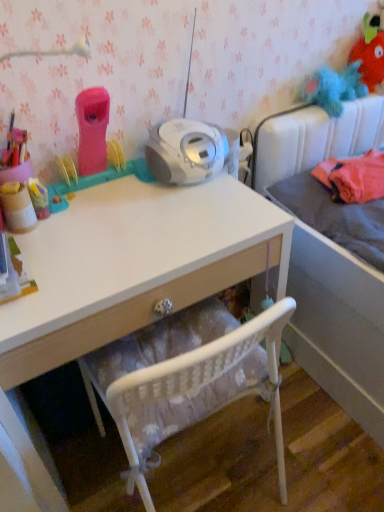
Question: From a real-world perspective, is fluffy plush toy at upper right, which appears as the first toy when viewed from the top, on top of gray fabric mattress at right?

Choices:
 (A) no
 (B) yes

Answer: (B)

Question: Can you confirm if fluffy plush toy at upper right, positioned as the 3th toy in bottom-to-top order, is wider than gray fabric mattress at right?

Choices:
 (A) yes
 (B) no

Answer: (B)

Question: From the image's perspective, would you say fluffy plush toy at upper right, positioned as the 3th toy in bottom-to-top order, is shown under gray fabric mattress at right?

Choices:
 (A) yes
 (B) no

Answer: (B)

Question: Would you say fluffy plush toy at upper right, positioned as the 3th toy in bottom-to-top order, contains gray fabric mattress at right?

Choices:
 (A) yes
 (B) no

Answer: (B)

Question: Considering the relative sizes of fluffy plush toy at upper right, placed as the first toy when sorted from back to front, and gray fabric mattress at right in the image provided, is fluffy plush toy at upper right, placed as the first toy when sorted from back to front, taller than gray fabric mattress at right?

Choices:
 (A) yes
 (B) no

Answer: (A)

Question: Is fluffy plush toy at upper right, the 3th toy viewed from the front, to the right of gray fabric mattress at right from the viewer's perspective?

Choices:
 (A) yes
 (B) no

Answer: (A)

Question: From the image's perspective, is gray fabric bed at upper right on top of white glossy desk at center?

Choices:
 (A) no
 (B) yes

Answer: (B)

Question: From the image's perspective, would you say gray fabric bed at upper right is shown under white glossy desk at center?

Choices:
 (A) no
 (B) yes

Answer: (A)

Question: Considering the relative sizes of gray fabric bed at upper right and white glossy desk at center in the image provided, is gray fabric bed at upper right smaller than white glossy desk at center?

Choices:
 (A) no
 (B) yes

Answer: (A)

Question: Could you tell me if gray fabric bed at upper right is turned towards white glossy desk at center?

Choices:
 (A) yes
 (B) no

Answer: (B)

Question: Is the surface of gray fabric bed at upper right in direct contact with white glossy desk at center?

Choices:
 (A) no
 (B) yes

Answer: (A)

Question: Does gray fabric bed at upper right have a larger size compared to white glossy desk at center?

Choices:
 (A) no
 (B) yes

Answer: (B)

Question: From a real-world perspective, is fluffy plush toy at upper right, positioned as the 3th toy in bottom-to-top order, beneath white glossy desk at center?

Choices:
 (A) yes
 (B) no

Answer: (B)